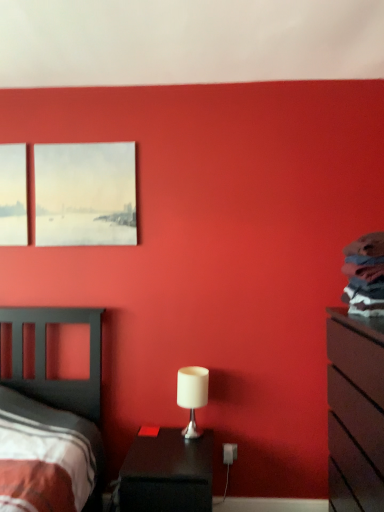
Describe the element at coordinates (167, 473) in the screenshot. The width and height of the screenshot is (384, 512). I see `black glossy nightstand at lower center` at that location.

This screenshot has height=512, width=384. What do you see at coordinates (355, 412) in the screenshot? I see `matte black dresser at right` at bounding box center [355, 412].

Find the location of a particular element. The width and height of the screenshot is (384, 512). black glossy nightstand at lower center is located at coordinates (167, 473).

Is matte black dresser at right not near white matte table lamp at center?

matte black dresser at right is actually quite close to white matte table lamp at center.

Which of these two, matte black dresser at right or white matte table lamp at center, is smaller?

white matte table lamp at center.

Which of these two, matte black dresser at right or white matte table lamp at center, stands shorter?

With less height is white matte table lamp at center.

From the image's perspective, is matte black dresser at right over white matte table lamp at center?

No.

Does black glossy nightstand at lower center appear on the right side of matte black dresser at right?

No, black glossy nightstand at lower center is not to the right of matte black dresser at right.

Is point (205, 441) farther from camera compared to point (377, 429)?

Yes, point (205, 441) is farther from viewer.

Considering the relative sizes of black glossy nightstand at lower center and matte canvas painting at upper left in the image provided, is black glossy nightstand at lower center bigger than matte canvas painting at upper left?

Indeed, black glossy nightstand at lower center has a larger size compared to matte canvas painting at upper left.

Is black glossy nightstand at lower center wider than matte canvas painting at upper left?

Correct, the width of black glossy nightstand at lower center exceeds that of matte canvas painting at upper left.

From a real-world perspective, relative to matte canvas painting at upper left, is black glossy nightstand at lower center vertically above or below?

From a real-world perspective, black glossy nightstand at lower center is physically below matte canvas painting at upper left.

Which is less distant, (203, 436) or (45, 237)?

The point (203, 436) is in front.

Considering the positions of objects white matte table lamp at center and matte canvas painting at upper left in the image provided, who is more to the left, white matte table lamp at center or matte canvas painting at upper left?

matte canvas painting at upper left.

Looking at this image, from the image's perspective, would you say white matte table lamp at center is positioned over matte canvas painting at upper left?

No.

Is matte black dresser at right at the back of matte canvas painting at upper left?

No, matte canvas painting at upper left is not facing away from matte black dresser at right.

Between matte canvas painting at upper left and matte black dresser at right, which one has more height?

Standing taller between the two is matte black dresser at right.

Consider the image. Is matte canvas painting at upper left wider or thinner than matte black dresser at right?

Considering their sizes, matte canvas painting at upper left looks slimmer than matte black dresser at right.

Relative to matte black dresser at right, is matte canvas painting at upper left in front or behind?

matte canvas painting at upper left is positioned farther from the viewer than matte black dresser at right.

Which is closer to the camera, (134, 211) or (181, 386)?

Point (181, 386)

Based on their positions, is matte canvas painting at upper left located to the left or right of white matte table lamp at center?

matte canvas painting at upper left is positioned on white matte table lamp at center's left side.

Considering the sizes of matte canvas painting at upper left and white matte table lamp at center in the image, is matte canvas painting at upper left taller or shorter than white matte table lamp at center?

In the image, matte canvas painting at upper left appears to be taller than white matte table lamp at center.

Find the location of a particular element. Image resolution: width=384 pixels, height=512 pixels. picture frame on the left of white matte table lamp at center is located at coordinates (85, 194).

Is white matte table lamp at center inside the boundaries of black glossy nightstand at lower center, or outside?

white matte table lamp at center is not enclosed by black glossy nightstand at lower center.

Locate an element on the screen. table lamp behind the black glossy nightstand at lower center is located at coordinates (192, 395).

Considering the sizes of objects white matte table lamp at center and black glossy nightstand at lower center in the image provided, who is bigger, white matte table lamp at center or black glossy nightstand at lower center?

black glossy nightstand at lower center.

You are a GUI agent. You are given a task and a screenshot of the screen. Output one action in this format:
    pyautogui.click(x=<x>, y=<y>)
    Task: Click on the chest of drawers in front of the white matte table lamp at center
    Image resolution: width=384 pixels, height=512 pixels.
    Given the screenshot: What is the action you would take?
    pyautogui.click(x=355, y=412)

Identify the location of chest of drawers that is on the right side of black glossy nightstand at lower center. The width and height of the screenshot is (384, 512). (355, 412).

When comparing their distances from matte black dresser at right, does matte canvas painting at upper left or black glossy nightstand at lower center seem further?

The object further to matte black dresser at right is matte canvas painting at upper left.

Consider the image. Estimate the real-world distances between objects in this image. Which object is further from white matte table lamp at center, black glossy nightstand at lower center or matte canvas painting at upper left?

The object further to white matte table lamp at center is matte canvas painting at upper left.

In the scene shown: Which object lies nearer to the anchor point white matte table lamp at center, matte canvas painting at upper left or matte black dresser at right?

matte black dresser at right.

From the image, which object appears to be nearer to matte canvas painting at upper left, white matte table lamp at center or black glossy nightstand at lower center?

Based on the image, white matte table lamp at center appears to be nearer to matte canvas painting at upper left.

Looking at the image, which one is located closer to matte black dresser at right, black glossy nightstand at lower center or white matte table lamp at center?

white matte table lamp at center is closer to matte black dresser at right.

From the picture: Considering their positions, is matte black dresser at right positioned closer to black glossy nightstand at lower center than white matte table lamp at center?

Based on the image, white matte table lamp at center appears to be nearer to black glossy nightstand at lower center.

Considering their positions, is matte black dresser at right positioned further to matte canvas painting at upper left than black glossy nightstand at lower center?

matte black dresser at right is positioned further to the anchor matte canvas painting at upper left.

Which object lies further to the anchor point matte black dresser at right, white matte table lamp at center or black glossy nightstand at lower center?

black glossy nightstand at lower center lies further to matte black dresser at right than the other object.

Image resolution: width=384 pixels, height=512 pixels. Find the location of `the chest of drawers between matte canvas painting at upper left and black glossy nightstand at lower center vertically`. the chest of drawers between matte canvas painting at upper left and black glossy nightstand at lower center vertically is located at coordinates (355, 412).

You are a GUI agent. You are given a task and a screenshot of the screen. Output one action in this format:
    pyautogui.click(x=<x>, y=<y>)
    Task: Click on the table lamp between matte canvas painting at upper left and matte black dresser at right in the horizontal direction
    The width and height of the screenshot is (384, 512).
    Given the screenshot: What is the action you would take?
    pyautogui.click(x=192, y=395)

Identify the location of table lamp situated between black glossy nightstand at lower center and matte black dresser at right from left to right. (192, 395).

I want to click on table lamp between matte canvas painting at upper left and black glossy nightstand at lower center in the up-down direction, so click(192, 395).